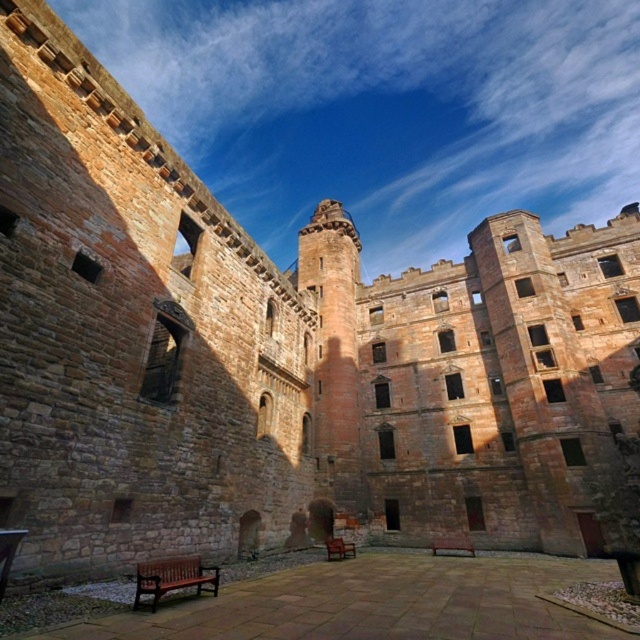
You are standing at the entrance of the castle courtyard and see the point marked at coordinates (452, 547). What is this point located on?

The point marked at coordinates (452, 547) is located on the brown wooden bench at center.

Based on the photo, you are a guest at the castle and want to sit on the tallest bench available. Which bench should you choose between the brown wooden bench at lower left and the brown wooden bench at center?

The brown wooden bench at lower left is taller than the brown wooden bench at center, so you should choose the brown wooden bench at lower left.

You are a visitor in the courtyard and want to sit down. You see two benches available. Which one offers more seating space? The brown wooden bench at lower left or the wooden bench at center?

The brown wooden bench at lower left offers more seating space because it has a larger size compared to the wooden bench at center.